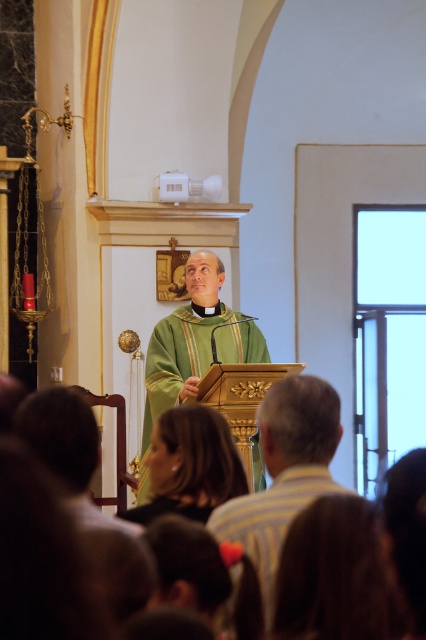
You are an attendee at the event and want to know where the priest is standing relative to the lectern. Which side of the green matte vestment at center is the gold polished lectern at center located?

The gold polished lectern at center is positioned on the right side of the green matte vestment at center.

You are a photographer standing at the back of the church. You want to take a photo of the gold polished lectern at center and the green matte vestment at center. If your camera has a maximum focus range of 3 meters, will both objects be in focus?

The gold polished lectern at center is 3.30 meters away from green matte vestment at center. Since the camera can only focus up to 3 meters, the distance between them exceeds the focus range, so both objects cannot be in focus simultaneously.

You are an interior designer planning to rearrange the items in the church scene. Considering the sizes of the gold polished lectern at center and the green matte vestment at center, which item would require more space if you were to move them to a different location?

The green matte vestment at center requires more space than the gold polished lectern at center because the gold polished lectern at center occupies less space than the green matte vestment at center.